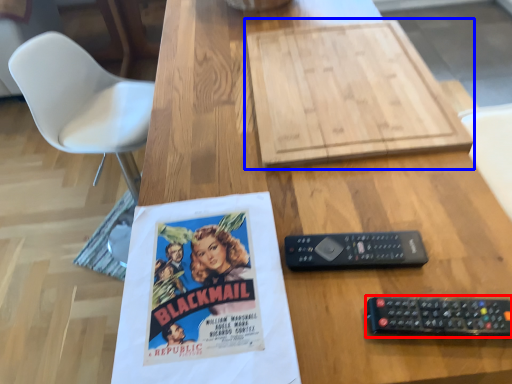
Question: Among these objects, which one is nearest to the camera, remote control (highlighted by a red box) or cardboard (highlighted by a blue box)?

Choices:
 (A) remote control
 (B) cardboard

Answer: (A)